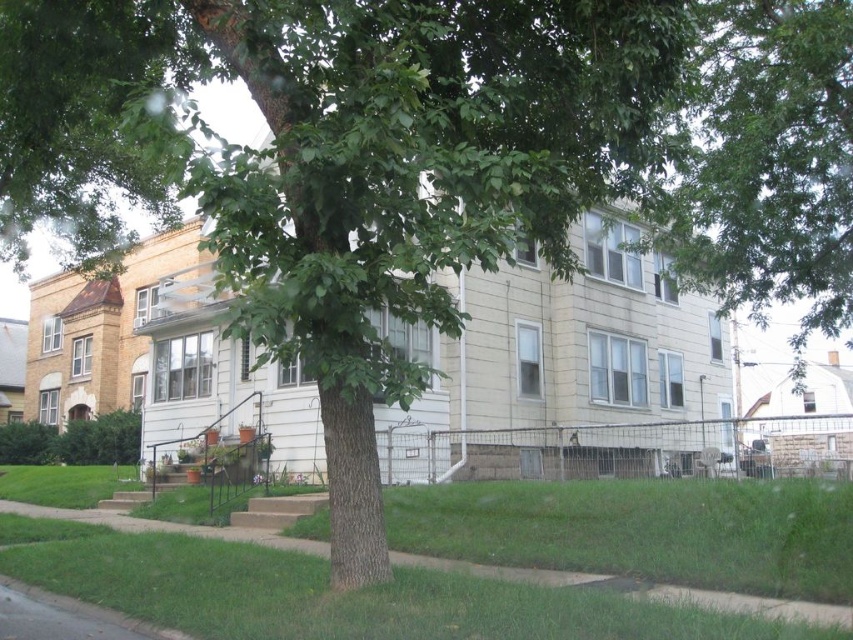
Is point (809, 266) closer to viewer compared to point (476, 593)?

No, (809, 266) is behind (476, 593).

Is green leafy tree at upper center smaller than green grass at lower center?

No.

Who is more forward, [677,164] or [78,582]?

Positioned in front is point [78,582].

Identify the location of green leafy tree at upper center. This screenshot has width=853, height=640. (766, 163).